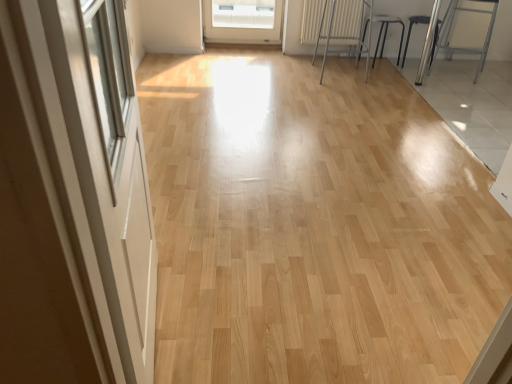
Question: Does white textured radiator at upper center appear on the right side of metallic silver armchair at right, which is the first armchair in right-to-left order?

Choices:
 (A) no
 (B) yes

Answer: (A)

Question: Considering the relative sizes of white textured radiator at upper center and metallic silver armchair at right, which is the first armchair in right-to-left order, in the image provided, is white textured radiator at upper center smaller than metallic silver armchair at right, which is the first armchair in right-to-left order,?

Choices:
 (A) yes
 (B) no

Answer: (A)

Question: Is white textured radiator at upper center at the left side of metallic silver armchair at right, the third armchair positioned from the left?

Choices:
 (A) yes
 (B) no

Answer: (A)

Question: Is white textured radiator at upper center not near metallic silver armchair at right, which is the first armchair in right-to-left order?

Choices:
 (A) yes
 (B) no

Answer: (A)

Question: Is white textured radiator at upper center positioned in front of metallic silver armchair at right, the third armchair positioned from the left?

Choices:
 (A) no
 (B) yes

Answer: (A)

Question: In terms of height, does metallic silver stool at upper right, which is the 3th armchair from right to left, look taller or shorter compared to white textured radiator at upper center?

Choices:
 (A) short
 (B) tall

Answer: (B)

Question: From the image's perspective, is metallic silver stool at upper right, which is the first armchair from left to right, above or below white textured radiator at upper center?

Choices:
 (A) below
 (B) above

Answer: (A)

Question: Considering the positions of metallic silver stool at upper right, which is the first armchair from left to right, and white textured radiator at upper center in the image, is metallic silver stool at upper right, which is the first armchair from left to right, wider or thinner than white textured radiator at upper center?

Choices:
 (A) thin
 (B) wide

Answer: (B)

Question: Based on their positions, is metallic silver stool at upper right, which is the first armchair from left to right, located to the left or right of white textured radiator at upper center?

Choices:
 (A) left
 (B) right

Answer: (B)

Question: Is black metal stool at upper right, the second armchair viewed from the right, taller or shorter than white glossy screen door at left?

Choices:
 (A) short
 (B) tall

Answer: (A)

Question: Looking at their shapes, would you say black metal stool at upper right, the second armchair viewed from the right, is wider or thinner than white glossy screen door at left?

Choices:
 (A) wide
 (B) thin

Answer: (A)

Question: From a real-world perspective, is black metal stool at upper right, the second armchair viewed from the right, positioned above or below white glossy screen door at left?

Choices:
 (A) above
 (B) below

Answer: (B)

Question: Relative to white glossy screen door at left, is black metal stool at upper right, the second armchair viewed from the right, in front or behind?

Choices:
 (A) front
 (B) behind

Answer: (B)

Question: From the image's perspective, is white textured radiator at upper center above or below white glossy screen door at left?

Choices:
 (A) above
 (B) below

Answer: (A)

Question: Based on their positions, is white textured radiator at upper center located to the left or right of white glossy screen door at left?

Choices:
 (A) left
 (B) right

Answer: (B)